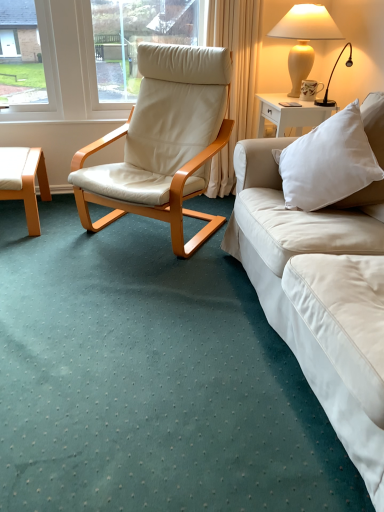
Measure the distance between white soft cushion at right and camera.

5.38 feet.

Locate an element on the screen. The width and height of the screenshot is (384, 512). white soft cushion at right is located at coordinates (337, 159).

Between matte ceramic mug at upper right and beige leather chair at center, which one has smaller width?

Thinner between the two is matte ceramic mug at upper right.

Is point (314, 81) in front of point (205, 217)?

No, (314, 81) is behind (205, 217).

Considering the sizes of matte ceramic mug at upper right and beige leather chair at center in the image, is matte ceramic mug at upper right taller or shorter than beige leather chair at center?

Clearly, matte ceramic mug at upper right is shorter compared to beige leather chair at center.

Which of these two, light brown wood coffee table at left or matte ceramic mug at upper right, is smaller?

matte ceramic mug at upper right.

How different are the orientations of light brown wood coffee table at left and matte ceramic mug at upper right in degrees?

The angle between the facing direction of light brown wood coffee table at left and the facing direction of matte ceramic mug at upper right is 87.6 degrees.

Where is `coffee cup above the light brown wood coffee table at left (from a real-world perspective)`? Image resolution: width=384 pixels, height=512 pixels. coffee cup above the light brown wood coffee table at left (from a real-world perspective) is located at coordinates point(310,89).

Is light brown wood coffee table at left positioned behind matte ceramic mug at upper right?

That is False.

From a real-world perspective, is matte cream vase at upper right under white soft cushion at right?

Actually, matte cream vase at upper right is physically above white soft cushion at right in the real world.

Considering the sizes of objects matte cream vase at upper right and white soft cushion at right in the image provided, who is taller, matte cream vase at upper right or white soft cushion at right?

matte cream vase at upper right is taller.

The image size is (384, 512). In the image, there is a white soft cushion at right. Identify the location of lamp above it (from the image's perspective). (304, 38).

Measure the distance from matte cream vase at upper right to white soft cushion at right.

They are 37.12 inches apart.

Is light brown wood coffee table at left facing away from matte cream vase at upper right?

No, light brown wood coffee table at left is not facing the opposite direction of matte cream vase at upper right.

Is light brown wood coffee table at left far from matte cream vase at upper right?

Indeed, light brown wood coffee table at left is not near matte cream vase at upper right.

Considering the sizes of objects light brown wood coffee table at left and matte cream vase at upper right in the image provided, who is smaller, light brown wood coffee table at left or matte cream vase at upper right?

Smaller between the two is light brown wood coffee table at left.

In terms of height, does light brown wood coffee table at left look taller or shorter compared to matte cream vase at upper right?

light brown wood coffee table at left is shorter than matte cream vase at upper right.

Considering the sizes of objects beige leather chair at center and matte cream vase at upper right in the image provided, who is thinner, beige leather chair at center or matte cream vase at upper right?

matte cream vase at upper right.

Is matte cream vase at upper right surrounded by beige leather chair at center?

No, beige leather chair at center does not contain matte cream vase at upper right.

Is beige leather chair at center oriented towards matte cream vase at upper right?

No, beige leather chair at center is not facing towards matte cream vase at upper right.

Does point (72, 175) appear closer or farther from the camera than point (305, 10)?

Point (72, 175) is positioned closer to the camera compared to point (305, 10).

Is matte ceramic mug at upper right aimed at matte cream vase at upper right?

Yes, matte ceramic mug at upper right is aimed at matte cream vase at upper right.

Is matte cream vase at upper right inside matte ceramic mug at upper right?

No, matte ceramic mug at upper right does not contain matte cream vase at upper right.

Is the position of matte ceramic mug at upper right less distant than that of matte cream vase at upper right?

That is False.

Considering the sizes of objects light brown wood coffee table at left and white soft cushion at right in the image provided, who is smaller, light brown wood coffee table at left or white soft cushion at right?

Smaller between the two is light brown wood coffee table at left.

Which of these two, light brown wood coffee table at left or white soft cushion at right, is wider?

Wider between the two is light brown wood coffee table at left.

Identify the location of chair that appears below the matte ceramic mug at upper right (from a real-world perspective). (163, 143).

The image size is (384, 512). Find the location of `coffee table on the left of matte ceramic mug at upper right`. coffee table on the left of matte ceramic mug at upper right is located at coordinates (24, 180).

Considering their positions, is beige leather chair at center positioned further to white soft cushion at right than light brown wood coffee table at left?

light brown wood coffee table at left is further to white soft cushion at right.

From the image, which object appears to be nearer to white soft cushion at right, matte ceramic mug at upper right or light brown wood coffee table at left?

matte ceramic mug at upper right lies closer to white soft cushion at right than the other object.

When comparing their distances from white soft cushion at right, does matte cream vase at upper right or beige leather chair at center seem further?

Based on the image, matte cream vase at upper right appears to be further to white soft cushion at right.

Looking at the image, which one is located closer to beige leather chair at center, matte ceramic mug at upper right or light brown wood coffee table at left?

light brown wood coffee table at left is positioned closer to the anchor beige leather chair at center.

From the image, which object appears to be farther from white soft cushion at right, matte cream vase at upper right or matte ceramic mug at upper right?

Based on the image, matte ceramic mug at upper right appears to be further to white soft cushion at right.

Estimate the real-world distances between objects in this image. Which object is closer to matte cream vase at upper right, matte ceramic mug at upper right or white soft cushion at right?

Based on the image, matte ceramic mug at upper right appears to be nearer to matte cream vase at upper right.

From the image, which object appears to be farther from light brown wood coffee table at left, matte ceramic mug at upper right or white soft cushion at right?

matte ceramic mug at upper right is positioned further to the anchor light brown wood coffee table at left.

Estimate the real-world distances between objects in this image. Which object is closer to beige leather chair at center, matte cream vase at upper right or matte ceramic mug at upper right?

matte cream vase at upper right is closer to beige leather chair at center.

The image size is (384, 512). What are the coordinates of `chair between light brown wood coffee table at left and matte ceramic mug at upper right from left to right` in the screenshot? It's located at (163, 143).

I want to click on chair situated between light brown wood coffee table at left and white soft cushion at right from left to right, so click(x=163, y=143).

The width and height of the screenshot is (384, 512). Identify the location of chair positioned between white soft cushion at right and matte ceramic mug at upper right from near to far. (163, 143).

Image resolution: width=384 pixels, height=512 pixels. Identify the location of pillow situated between light brown wood coffee table at left and matte ceramic mug at upper right from left to right. (337, 159).